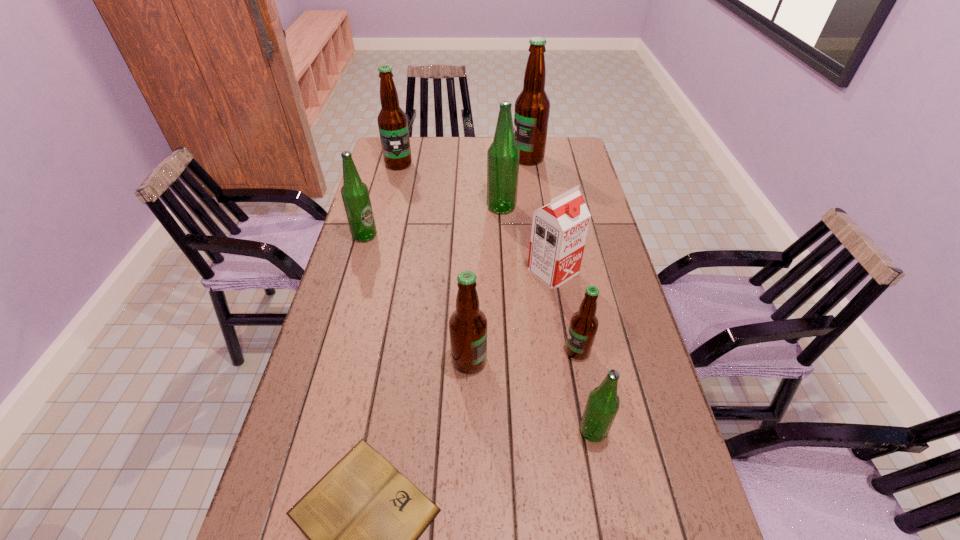
The image size is (960, 540). I want to click on the smallest brown beer bottle, so click(583, 326).

Locate an element on the screen. The image size is (960, 540). the nearest green beer bottle is located at coordinates (602, 405).

Image resolution: width=960 pixels, height=540 pixels. I want to click on the nearest beer bottle, so click(602, 405).

Find the location of `free space located 0.280m on the label of the tallest beer bottle`. free space located 0.280m on the label of the tallest beer bottle is located at coordinates (443, 158).

At what (x,y) coordinates should I click in order to perform the action: click on free spot located 0.330m on the label of the tallest beer bottle. Please return your answer as a coordinate pair (x, y). Looking at the image, I should click on (431, 158).

You are a GUI agent. You are given a task and a screenshot of the screen. Output one action in this format:
    pyautogui.click(x=<x>, y=<y>)
    Task: Click on the vacant region located 0.190m on the label of the tallest beer bottle
    This screenshot has width=960, height=540.
    Given the screenshot: What is the action you would take?
    pyautogui.click(x=466, y=158)

In order to click on vacant point located on the label of the fifth object from right to left in this screenshot , I will do `click(424, 207)`.

Locate an element on the screen. The height and width of the screenshot is (540, 960). free spot located 0.090m on the label of the fifth object from right to left is located at coordinates (461, 207).

This screenshot has width=960, height=540. I want to click on free space located on the label of the fifth object from right to left, so click(433, 207).

Identify the location of free spot located 0.300m on the label of the second biggest brown beer bottle. (385, 219).